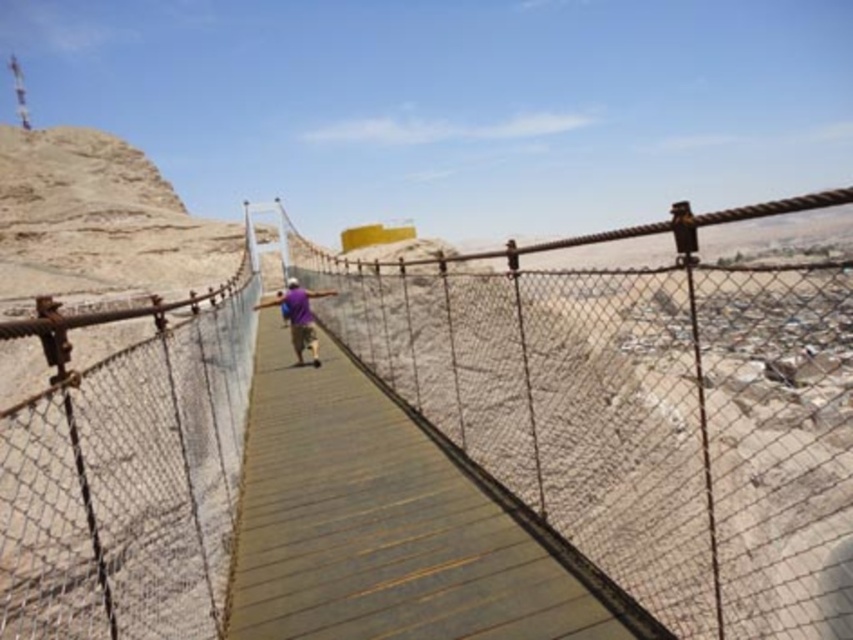
You are a hiker standing on the wooden walkway of the suspension bridge in the desert. You notice a wooden at center and a purple fabric shirt at center. Which object is closer to you?

The wooden at center is smaller than the purple fabric shirt at center, so the purple fabric shirt at center is closer to you.

You are a hiker who wants to cross the desert using the bridge. You have a 2m wide tent that needs to be carried across. Can the rusty metal suspension bridge at center and the wooden at center accommodate the tent? Please explain.

The rusty metal suspension bridge at center is wider than the wooden at center. Since the tent is 2 meters wide, it depends on the minimum width between them. However, the description only states the suspension bridge is wider, but not the exact measurements. Without knowing the exact width of the wooden part, we can only confirm the suspension bridge is wider, but cannot determine if either can fit the tent.

You are standing on the suspension bridge and notice two items at the center of the bridge. Which object is located below the other? The wooden at center or the purple fabric shirt at center?

The wooden at center is positioned under the purple fabric shirt at center.